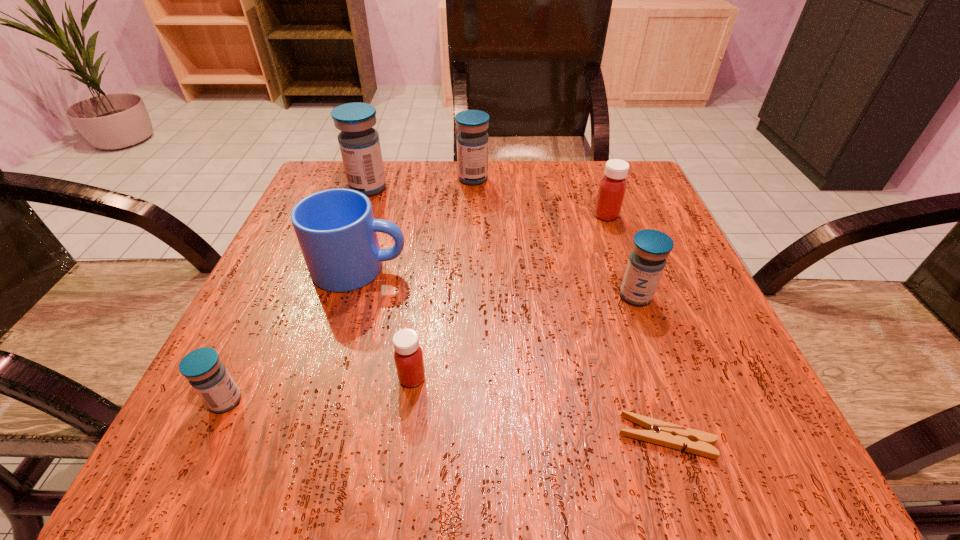
Locate an element on the screen. The image size is (960, 540). object that is at the near right corner is located at coordinates (662, 433).

This screenshot has width=960, height=540. Identify the location of blank area at the far edge. (407, 195).

Find the location of a particular element. This screenshot has height=540, width=960. free spot at the near edge of the desktop is located at coordinates (546, 422).

In order to click on vacant space at the left edge in this screenshot , I will do `click(273, 339)`.

Image resolution: width=960 pixels, height=540 pixels. In the image, there is a desktop. Identify the location of vacant space at the right edge. (659, 322).

You are a GUI agent. You are given a task and a screenshot of the screen. Output one action in this format:
    pyautogui.click(x=<x>, y=<y>)
    Task: Click on the vacant region at the far left corner of the desktop
    Image resolution: width=960 pixels, height=540 pixels.
    Given the screenshot: What is the action you would take?
    pyautogui.click(x=330, y=183)

Where is `vacant space at the far right corner of the desktop`? This screenshot has width=960, height=540. vacant space at the far right corner of the desktop is located at coordinates (583, 167).

Locate an element on the screen. Image resolution: width=960 pixels, height=540 pixels. vacant space at the near right corner of the desktop is located at coordinates (651, 413).

Identify the location of vacant region between the fourth medicine from left to right and the shortest object. The width and height of the screenshot is (960, 540). (569, 308).

This screenshot has width=960, height=540. I want to click on free space between the mug and the fourth medicine from right to left, so click(x=386, y=323).